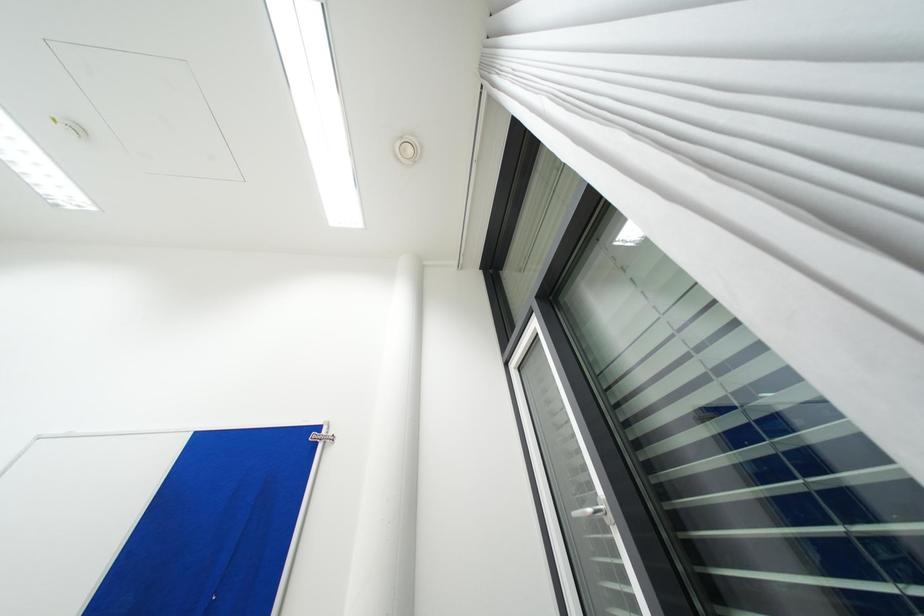
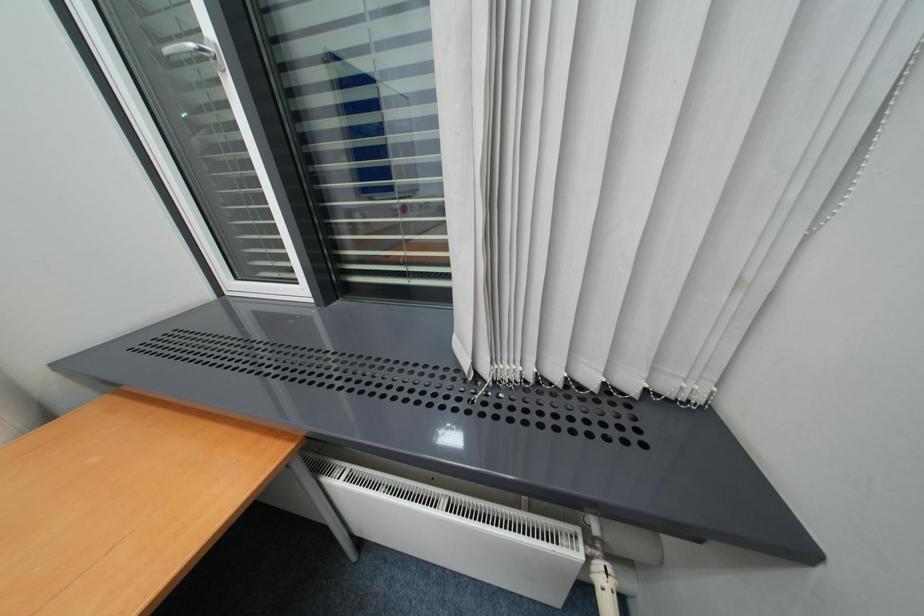
The first image is from the beginning of the video and the second image is from the end. How did the camera likely rotate when shooting the video?

The camera rotated toward right-down.